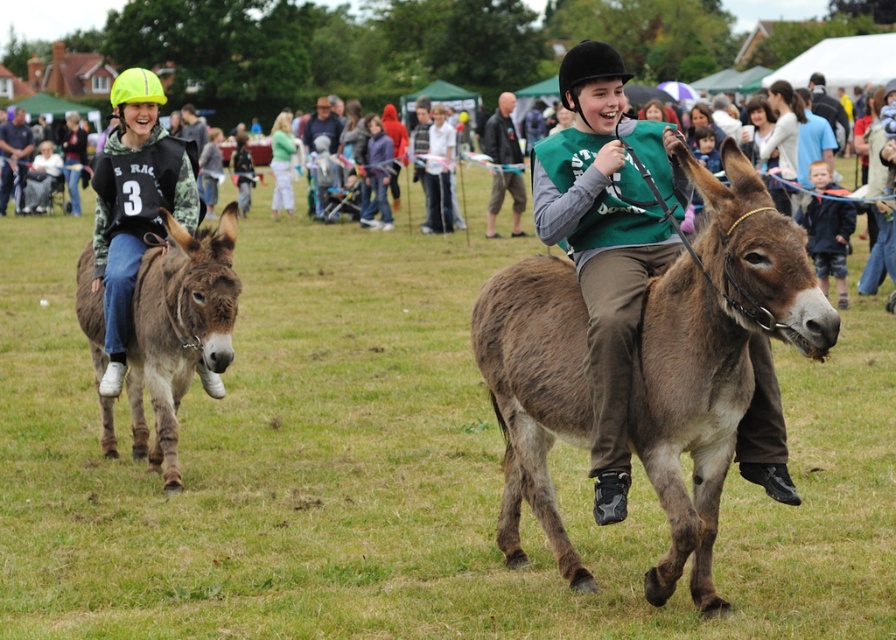
You are a photographer trying to capture a clear shot of both the brown fuzzy mule at left and the neon yellow helmet at left. Since you want to ensure both are fully visible in your frame, which object should you adjust your focus on to account for their size difference?

The brown fuzzy mule at left is wider than the neon yellow helmet at left, so you should focus on the brown fuzzy mule at left to ensure it fits within the frame while the smaller neon yellow helmet at left will naturally be included.

You are a photographer setting up a camera to capture the two brown fuzzy mules in the scene. The camera has a fixed width of 2 meters. Can you fit both the brown fuzzy mule at center and the brown fuzzy mule at left into the camera frame at the same time?

The brown fuzzy mule at center is wider than the brown fuzzy mule at left. However, since the camera has a fixed width of 2 meters, you need to know the combined width of both mules to determine if they can fit. Unfortunately, the exact widths are not provided, so it is impossible to confirm if they can both fit into the frame together.